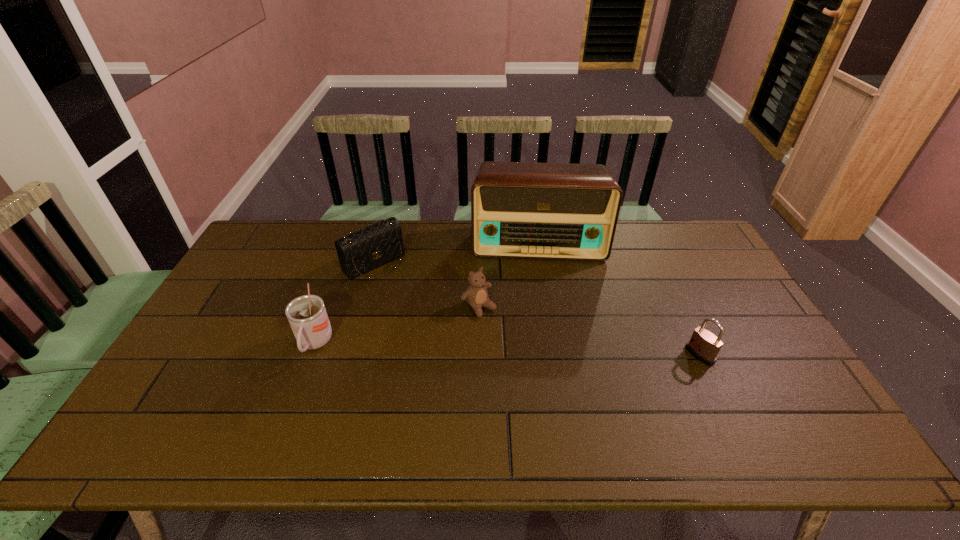
At what (x,y) coordinates should I click in order to perform the action: click on cup. Please return your answer as a coordinate pair (x, y). Image resolution: width=960 pixels, height=540 pixels. Looking at the image, I should click on (307, 315).

In order to click on padlock in this screenshot , I will do `click(703, 345)`.

The height and width of the screenshot is (540, 960). Identify the location of radio receiver. (552, 211).

Where is `clutch bag`? This screenshot has width=960, height=540. clutch bag is located at coordinates (362, 251).

The image size is (960, 540). Identify the location of teddy bear. (476, 294).

Where is `free location located 0.060m on the side with the handle of the cup`? Image resolution: width=960 pixels, height=540 pixels. free location located 0.060m on the side with the handle of the cup is located at coordinates (300, 385).

This screenshot has height=540, width=960. In order to click on vacant space situated 0.380m on the back of the rightmost object in this screenshot , I will do `click(654, 258)`.

Image resolution: width=960 pixels, height=540 pixels. Identify the location of free spot located on the front-facing side of the tallest object. (538, 287).

Find the location of a particular element. free spot located 0.290m on the front-facing side of the tallest object is located at coordinates (540, 327).

Locate an element on the screen. The width and height of the screenshot is (960, 540). free space located on the front-facing side of the tallest object is located at coordinates (541, 335).